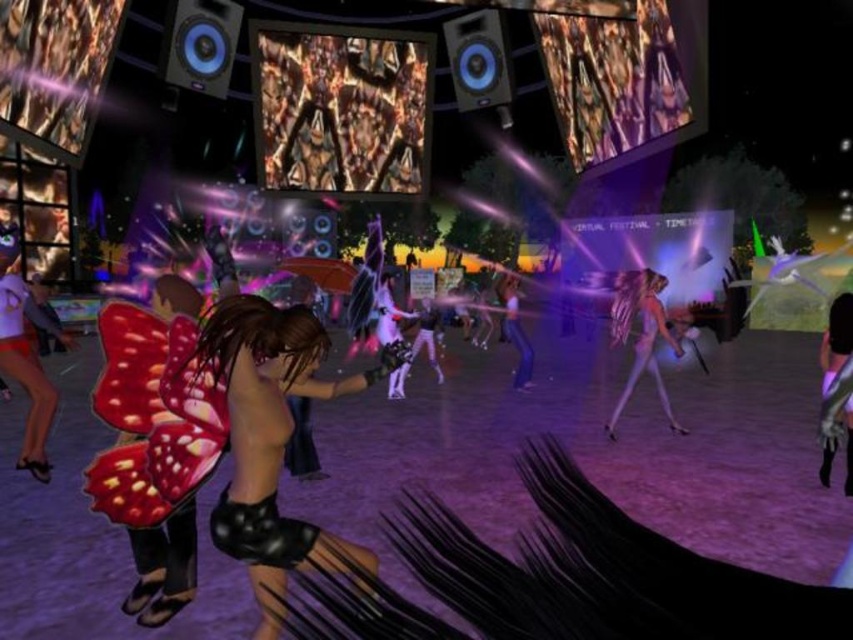
You are a character in this virtual environment and want to hide behind an object to avoid being seen. Which object can you use to hide behind, the shiny black shorts at center or the translucent purple hair at center?

The shiny black shorts at center is much taller than the translucent purple hair at center, so you can hide behind the shiny black shorts at center.

You are an avatar in the virtual environment and want to find your lost item, which is the shiny black shorts at center. According to the scene description, where should you look for it?

The shiny black shorts at center is located at point (271, 440).

You are a character in this virtual environment and need to move from point A to point B. Point A is at coordinates point (273, 433) and point B is at coordinates point (610, 433). Which point is closer to your current position if you are standing at the camera position?

Point (273, 433) is closer to the camera than point (610, 433), so you are closer to point A.